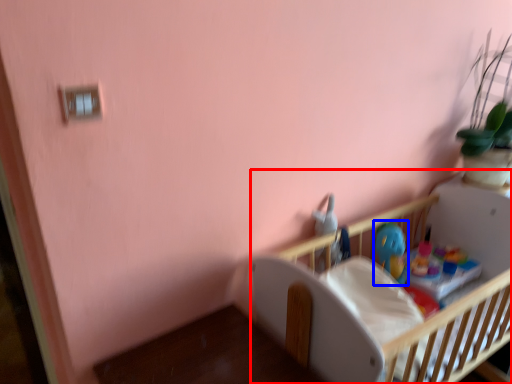
Question: Among these objects, which one is nearest to the camera, infant bed (highlighted by a red box) or toy (highlighted by a blue box)?

Choices:
 (A) infant bed
 (B) toy

Answer: (A)